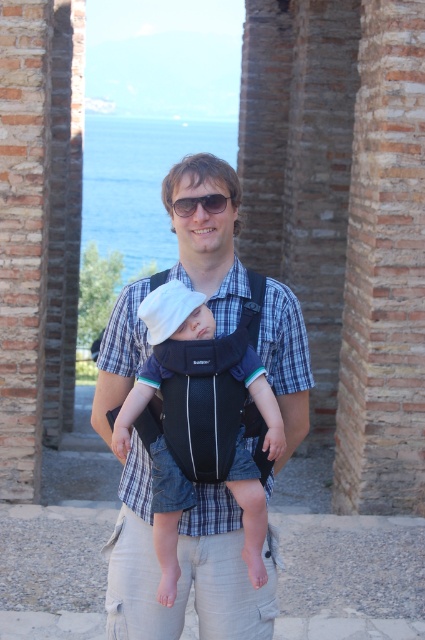
You are a photographer trying to capture a closeup shot of the man and the baby. You notice the matte black baby carrier at center and the black plastic sunglasses at center in your frame. Which object should you adjust your focus to ensure the baby is in focus, considering their relative sizes?

The matte black baby carrier at center might be wider than black plastic sunglasses at center, so focusing on the carrier will help ensure the baby is in focus as it is larger and closer to the camera.